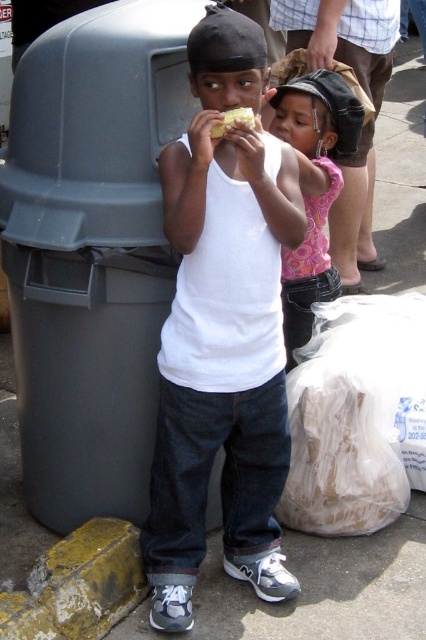
Who is shorter, gray plastic trash can at left or white matte tank top at center?

With less height is gray plastic trash can at left.

Is gray plastic trash can at left wider than white matte tank top at center?

Correct, the width of gray plastic trash can at left exceeds that of white matte tank top at center.

Locate an element on the screen. gray plastic trash can at left is located at coordinates (92, 250).

Does white matte tank top at center appear on the right side of yellow crumbly food at center?

Correct, you'll find white matte tank top at center to the right of yellow crumbly food at center.

Is white matte tank top at center bigger than yellow crumbly food at center?

Yes.

Is point (250, 54) closer to viewer compared to point (218, 134)?

That is True.

This screenshot has height=640, width=426. I want to click on white matte tank top at center, so click(x=222, y=330).

Between gray plastic trash can at left and yellow crumbly food at center, which one appears on the right side from the viewer's perspective?

Positioned to the right is yellow crumbly food at center.

Where is `gray plastic trash can at left`? The width and height of the screenshot is (426, 640). gray plastic trash can at left is located at coordinates (92, 250).

Who is more forward, (22, 214) or (226, 129)?

Positioned in front is point (226, 129).

Where is `gray plastic trash can at left`? This screenshot has width=426, height=640. gray plastic trash can at left is located at coordinates pos(92,250).